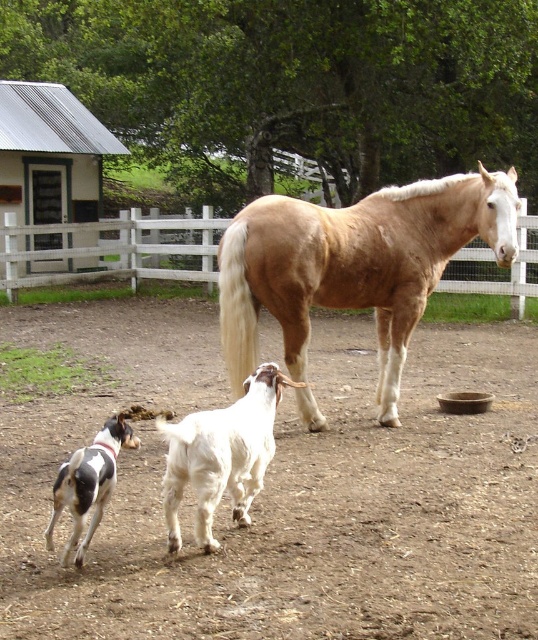
Can you confirm if brown dirt field at center is thinner than light brown glossy horse at center?

In fact, brown dirt field at center might be wider than light brown glossy horse at center.

Is brown dirt field at center smaller than light brown glossy horse at center?

Incorrect, brown dirt field at center is not smaller in size than light brown glossy horse at center.

You are a GUI agent. You are given a task and a screenshot of the screen. Output one action in this format:
    pyautogui.click(x=<x>, y=<y>)
    Task: Click on the brown dirt field at center
    The image size is (538, 640).
    Given the screenshot: What is the action you would take?
    pyautogui.click(x=284, y=490)

Find the location of a particular element. The image size is (538, 640). brown dirt field at center is located at coordinates (284, 490).

Which is above, brown dirt field at center or spotted fur dog at lower left?

brown dirt field at center is above.

Which is below, brown dirt field at center or spotted fur dog at lower left?

spotted fur dog at lower left

Find the location of `brown dirt field at center`. brown dirt field at center is located at coordinates (284, 490).

Is white wooden fence at center to the right of white fur dog at lower left from the viewer's perspective?

Incorrect, white wooden fence at center is not on the right side of white fur dog at lower left.

Does white wooden fence at center have a greater width compared to white fur dog at lower left?

Correct, the width of white wooden fence at center exceeds that of white fur dog at lower left.

Between point (72, 276) and point (220, 438), which one is positioned in front?

Point (220, 438)

You are a GUI agent. You are given a task and a screenshot of the screen. Output one action in this format:
    pyautogui.click(x=<x>, y=<y>)
    Task: Click on the white wooden fence at center
    The width and height of the screenshot is (538, 640).
    Given the screenshot: What is the action you would take?
    pyautogui.click(x=116, y=250)